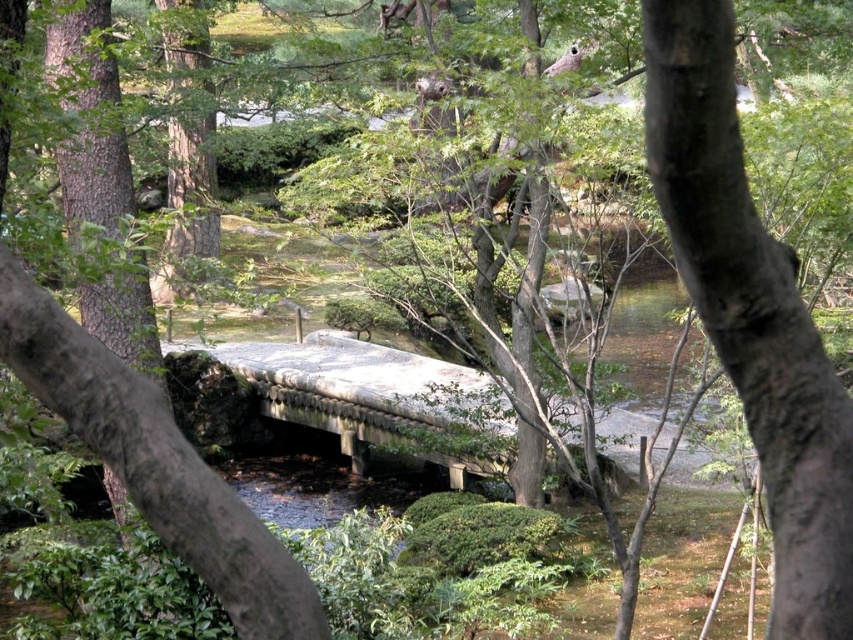
Is point (762, 269) positioned after point (340, 410)?

No.

In the scene shown: Is smooth brown bark at center smaller than stone bridge at center?

Yes.

Locate an element on the screen. smooth brown bark at center is located at coordinates (751, 314).